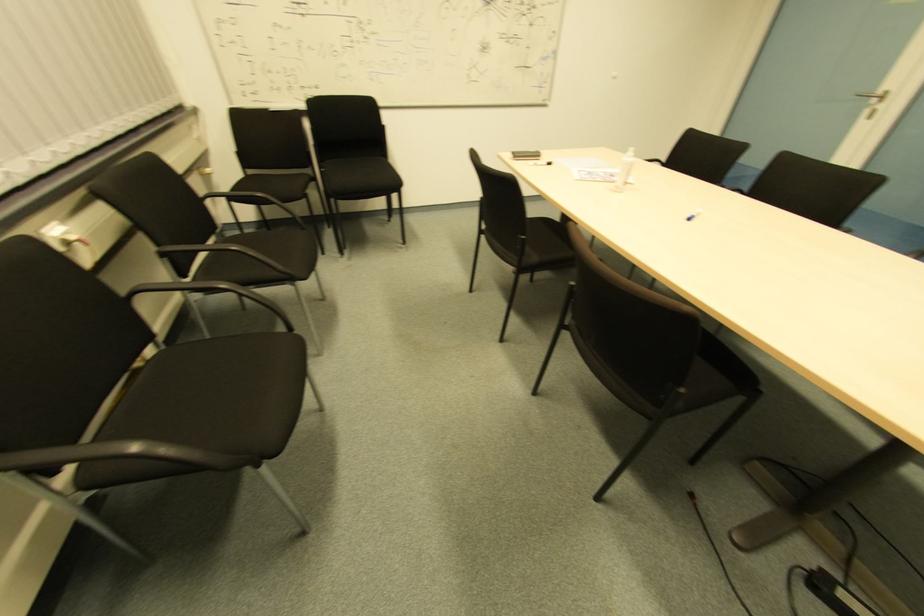
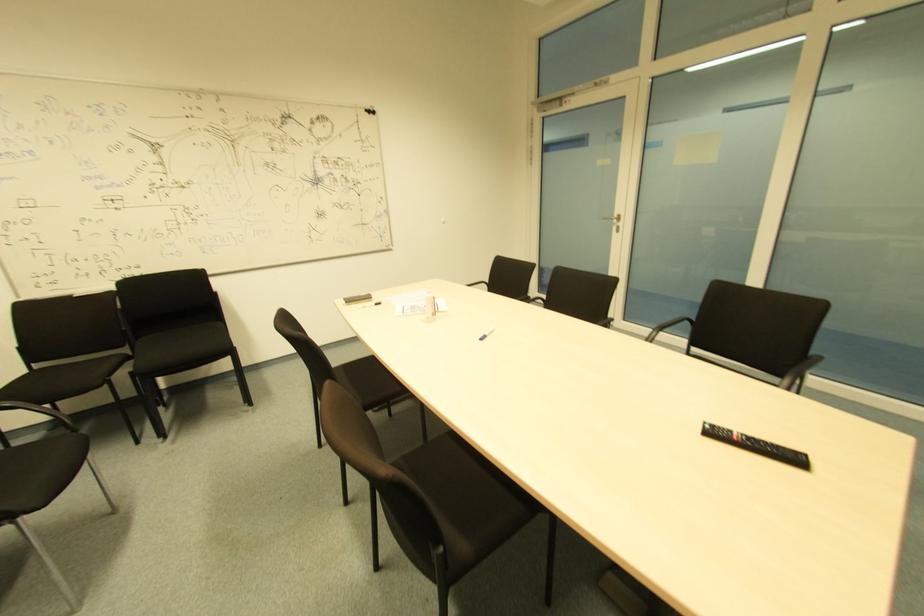
In the second image, find the point that corresponds to (881,108) in the first image.

(618, 227)